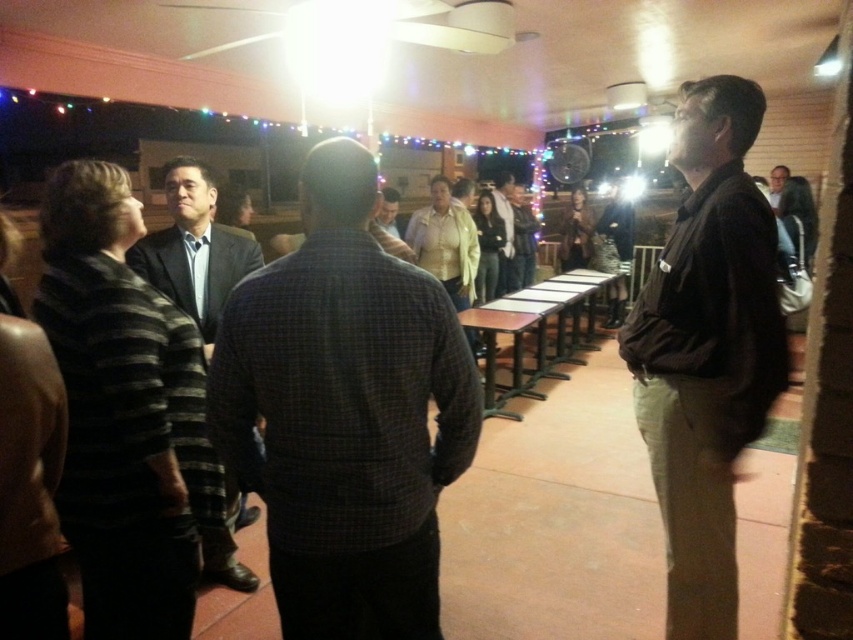
You are standing at the entrance of the room and want to greet the person in the dark suit at center. Based on the coordinates provided, in which direction should you walk to reach them?

The dark suit at center is located at coordinates point [194,248], so you should walk towards the center of the room to reach them.

You are a photographer taking a picture of the social gathering. You want to ensure both the dark brown shirt at center and the dark suit at center are clearly visible in your photo. Which one should you focus on first to ensure depth of field captures both?

You should focus on the dark brown shirt at center first because it is closer to the viewer than the dark suit at center. By focusing on the closer object, the depth of field will extend backward, potentially keeping both in focus.